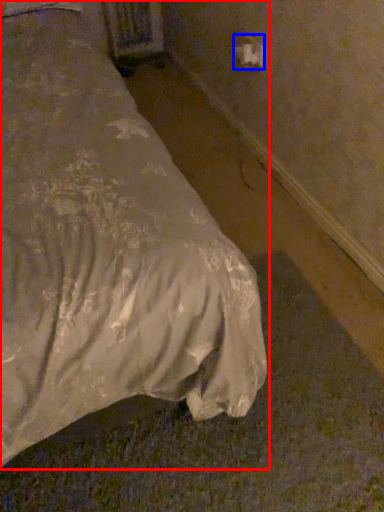
Question: Which object is further to the camera taking this photo, bed (highlighted by a red box) or electric outlet (highlighted by a blue box)?

Choices:
 (A) bed
 (B) electric outlet

Answer: (B)